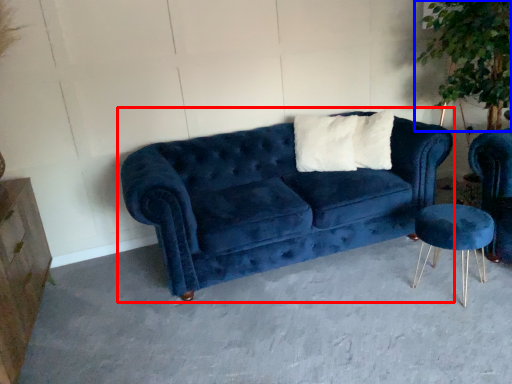
Question: Which of the following is the closest to the observer, studio couch (highlighted by a red box) or plant (highlighted by a blue box)?

Choices:
 (A) studio couch
 (B) plant

Answer: (A)